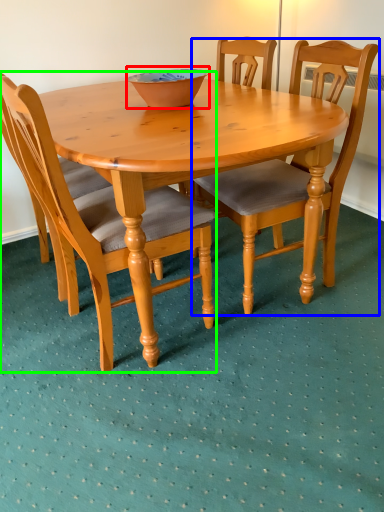
Question: Estimate the real-world distances between objects in this image. Which object is closer to bowl (highlighted by a red box), chair (highlighted by a blue box) or chair (highlighted by a green box)?

Choices:
 (A) chair
 (B) chair

Answer: (B)